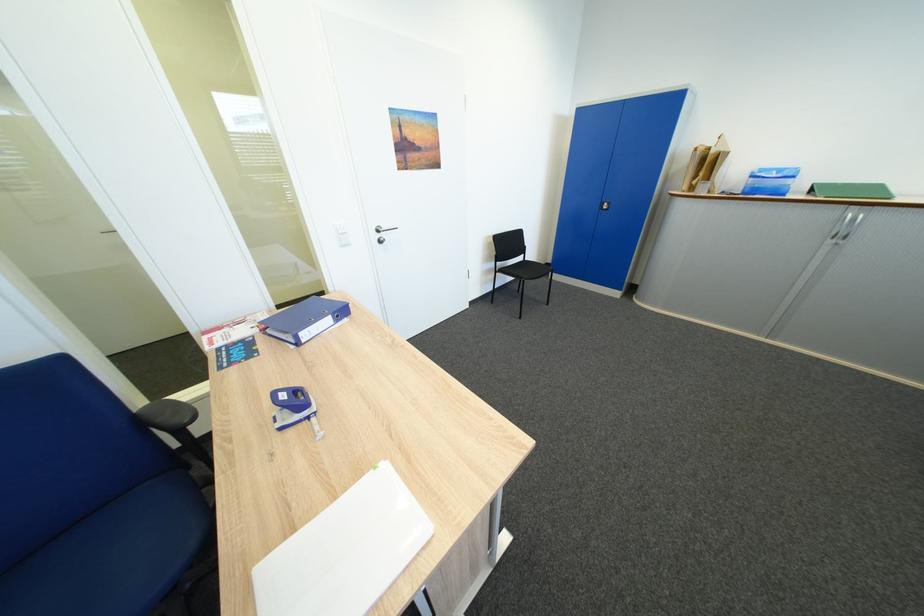
Find the location of a particular element. This screenshot has height=616, width=924. blue document tray is located at coordinates (305, 320).